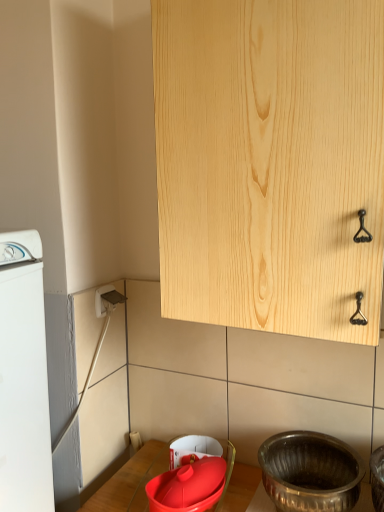
Question: Is white plastic electric outlet at lower left at the back of matte red basin at lower center, the first basin from the left?

Choices:
 (A) no
 (B) yes

Answer: (A)

Question: Is matte red basin at lower center, the first basin from the left, to the left of white plastic electric outlet at lower left from the viewer's perspective?

Choices:
 (A) yes
 (B) no

Answer: (B)

Question: Does matte red basin at lower center, the first basin from the left, have a greater width compared to white plastic electric outlet at lower left?

Choices:
 (A) no
 (B) yes

Answer: (B)

Question: Is matte red basin at lower center, positioned as the second basin in right-to-left order, to the right of white plastic electric outlet at lower left from the viewer's perspective?

Choices:
 (A) no
 (B) yes

Answer: (B)

Question: Is matte red basin at lower center, the first basin from the left, taller than white plastic electric outlet at lower left?

Choices:
 (A) no
 (B) yes

Answer: (B)

Question: From the image's perspective, is matte red basin at lower center, positioned as the second basin in right-to-left order, under white plastic electric outlet at lower left?

Choices:
 (A) no
 (B) yes

Answer: (B)

Question: Can you confirm if polished silver basin at lower right, marked as the first basin in a right-to-left arrangement, is wider than matte red basin at lower center, positioned as the second basin in right-to-left order?

Choices:
 (A) yes
 (B) no

Answer: (A)

Question: From a real-world perspective, is polished silver basin at lower right, the 2th basin when ordered from left to right, on matte red basin at lower center, positioned as the second basin in right-to-left order?

Choices:
 (A) no
 (B) yes

Answer: (B)

Question: Is polished silver basin at lower right, marked as the first basin in a right-to-left arrangement, positioned before matte red basin at lower center, the first basin from the left?

Choices:
 (A) yes
 (B) no

Answer: (A)

Question: Considering the relative sizes of polished silver basin at lower right, the 2th basin when ordered from left to right, and matte red basin at lower center, positioned as the second basin in right-to-left order, in the image provided, is polished silver basin at lower right, the 2th basin when ordered from left to right, bigger than matte red basin at lower center, positioned as the second basin in right-to-left order,?

Choices:
 (A) yes
 (B) no

Answer: (A)

Question: Can you confirm if polished silver basin at lower right, the 2th basin when ordered from left to right, is positioned to the right of matte red basin at lower center, positioned as the second basin in right-to-left order?

Choices:
 (A) yes
 (B) no

Answer: (A)

Question: Is polished silver basin at lower right, the 2th basin when ordered from left to right, further to the viewer compared to matte red basin at lower center, positioned as the second basin in right-to-left order?

Choices:
 (A) no
 (B) yes

Answer: (A)

Question: Considering the relative positions of natural wood cabinet at upper center and matte red basin at lower center, the first basin from the left, in the image provided, is natural wood cabinet at upper center behind matte red basin at lower center, the first basin from the left,?

Choices:
 (A) no
 (B) yes

Answer: (A)